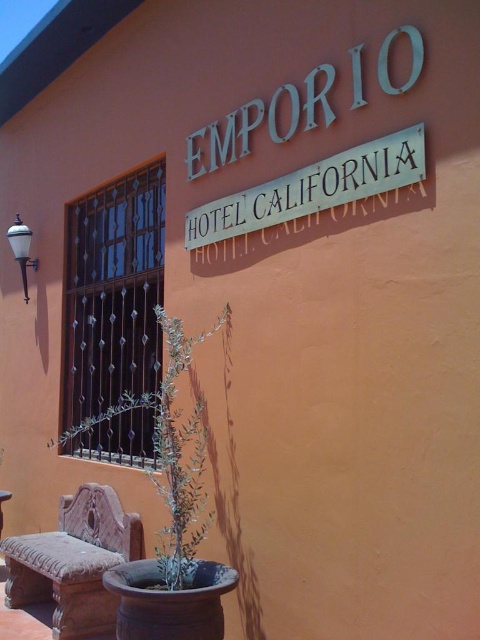
Question: In this image, where is metallic silver sign at upper center located relative to green leafy plant at center?

Choices:
 (A) above
 (B) below

Answer: (A)

Question: Which point is farther to the camera?

Choices:
 (A) metallic silver sign at upper center
 (B) green leafy plant at center
 (C) terracotta carved bench at lower left
 (D) wooden stool at lower left

Answer: (D)

Question: Can you confirm if metallic silver sign at upper center is positioned to the right of green leafy plant at center?

Choices:
 (A) no
 (B) yes

Answer: (B)

Question: Which of the following is the farthest from the observer?

Choices:
 (A) (236, 193)
 (B) (166, 476)
 (C) (120, 547)
 (D) (0, 516)

Answer: (D)

Question: Which point is farther from the camera taking this photo?

Choices:
 (A) (95, 426)
 (B) (1, 561)
 (C) (225, 236)
 (D) (29, 545)

Answer: (B)

Question: Is terracotta carved bench at lower left further to the viewer compared to wooden stool at lower left?

Choices:
 (A) yes
 (B) no

Answer: (B)